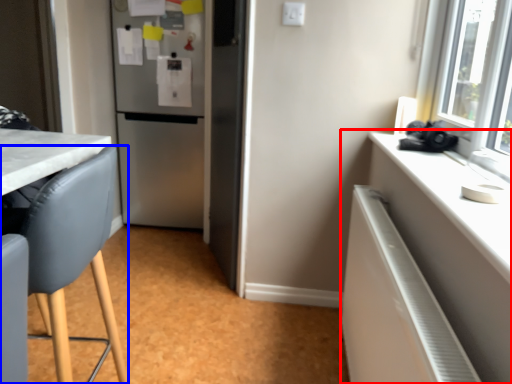
Question: Among these objects, which one is farthest to the camera, cabinetry (highlighted by a red box) or chair (highlighted by a blue box)?

Choices:
 (A) cabinetry
 (B) chair

Answer: (B)